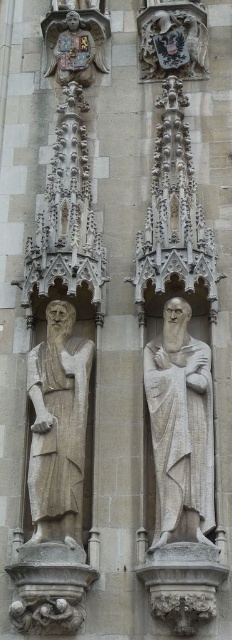
Is white stone statue at center behind stone statue at center?

No, white stone statue at center is closer to the viewer.

Between white stone statue at center and stone statue at center, which one has less height?

white stone statue at center is shorter.

The width and height of the screenshot is (232, 640). What do you see at coordinates (180, 428) in the screenshot?
I see `white stone statue at center` at bounding box center [180, 428].

Locate an element on the screen. This screenshot has height=640, width=232. white stone statue at center is located at coordinates (180, 428).